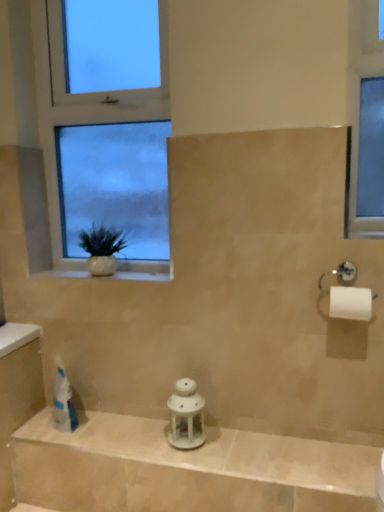
Question: Can you confirm if white glass window at upper left is positioned to the left of white ceramic vase at left?

Choices:
 (A) yes
 (B) no

Answer: (A)

Question: Can we say white glass window at upper left lies outside white ceramic vase at left?

Choices:
 (A) no
 (B) yes

Answer: (B)

Question: Is white glass window at upper left looking in the opposite direction of white ceramic vase at left?

Choices:
 (A) no
 (B) yes

Answer: (A)

Question: Can you confirm if white glass window at upper left is smaller than white ceramic vase at left?

Choices:
 (A) yes
 (B) no

Answer: (B)

Question: Is white glass window at upper left positioned in front of white ceramic vase at left?

Choices:
 (A) yes
 (B) no

Answer: (A)

Question: Visually, is white ceramic vase at left positioned to the left or to the right of white matte toilet paper at right?

Choices:
 (A) left
 (B) right

Answer: (A)

Question: Considering the positions of white ceramic vase at left and white matte toilet paper at right in the image, is white ceramic vase at left taller or shorter than white matte toilet paper at right?

Choices:
 (A) tall
 (B) short

Answer: (B)

Question: Do you think white ceramic vase at left is within white matte toilet paper at right, or outside of it?

Choices:
 (A) outside
 (B) inside

Answer: (A)

Question: Based on their sizes in the image, would you say white ceramic vase at left is bigger or smaller than white matte toilet paper at right?

Choices:
 (A) big
 (B) small

Answer: (B)

Question: Is white glossy lantern at center inside the boundaries of white matte toilet paper at right, or outside?

Choices:
 (A) outside
 (B) inside

Answer: (A)

Question: From the image's perspective, is white glossy lantern at center positioned above or below white matte toilet paper at right?

Choices:
 (A) above
 (B) below

Answer: (B)

Question: Based on their sizes in the image, would you say white glossy lantern at center is bigger or smaller than white matte toilet paper at right?

Choices:
 (A) big
 (B) small

Answer: (A)

Question: Considering the positions of white glossy lantern at center and white matte toilet paper at right in the image, is white glossy lantern at center taller or shorter than white matte toilet paper at right?

Choices:
 (A) tall
 (B) short

Answer: (B)

Question: Is point (31, 17) closer or farther from the camera than point (173, 501)?

Choices:
 (A) farther
 (B) closer

Answer: (A)

Question: From their relative heights in the image, would you say white glass window at upper left is taller or shorter than white glossy lantern at center?

Choices:
 (A) tall
 (B) short

Answer: (A)